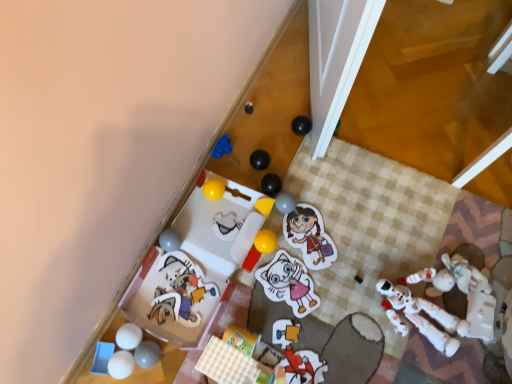
I want to click on free spot behind rubber matte ball at center, which ranks as the thirteenth toy in left-to-right order, so click(x=306, y=172).